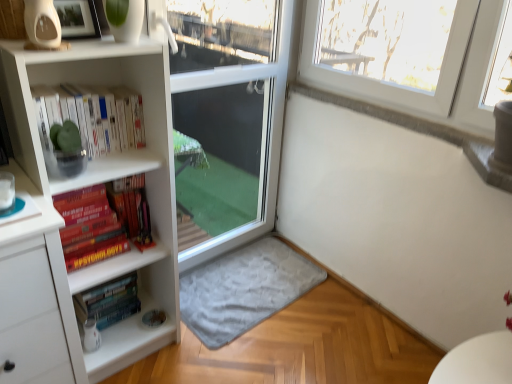
Question: Considering the relative positions of gray soft rug at lower center and white glossy bookshelf at upper left in the image provided, is gray soft rug at lower center to the left of white glossy bookshelf at upper left from the viewer's perspective?

Choices:
 (A) no
 (B) yes

Answer: (A)

Question: Is gray soft rug at lower center positioned in front of white glossy bookshelf at upper left?

Choices:
 (A) yes
 (B) no

Answer: (B)

Question: Considering the relative sizes of gray soft rug at lower center and white glossy bookshelf at upper left in the image provided, is gray soft rug at lower center shorter than white glossy bookshelf at upper left?

Choices:
 (A) no
 (B) yes

Answer: (B)

Question: Can you confirm if gray soft rug at lower center is taller than white glossy bookshelf at upper left?

Choices:
 (A) no
 (B) yes

Answer: (A)

Question: From the image's perspective, does gray soft rug at lower center appear higher than white glossy bookshelf at upper left?

Choices:
 (A) no
 (B) yes

Answer: (A)

Question: Is hardcover psychology book at left, which is the 1th book in top-to-bottom order, wider or thinner than gray soft rug at lower center?

Choices:
 (A) wide
 (B) thin

Answer: (B)

Question: Does point (73, 258) appear closer or farther from the camera than point (187, 296)?

Choices:
 (A) farther
 (B) closer

Answer: (B)

Question: Based on their sizes in the image, would you say hardcover psychology book at left, which is the 1th book in top-to-bottom order, is bigger or smaller than gray soft rug at lower center?

Choices:
 (A) small
 (B) big

Answer: (B)

Question: In the image, is hardcover psychology book at left, which is the 1th book in top-to-bottom order, positioned in front of or behind gray soft rug at lower center?

Choices:
 (A) behind
 (B) front

Answer: (B)

Question: Is point (210, 77) positioned closer to the camera than point (272, 312)?

Choices:
 (A) closer
 (B) farther

Answer: (A)

Question: Is transparent glass screen door at center taller or shorter than gray soft rug at lower center?

Choices:
 (A) tall
 (B) short

Answer: (A)

Question: Is transparent glass screen door at center inside the boundaries of gray soft rug at lower center, or outside?

Choices:
 (A) inside
 (B) outside

Answer: (B)

Question: In terms of size, does transparent glass screen door at center appear bigger or smaller than gray soft rug at lower center?

Choices:
 (A) big
 (B) small

Answer: (A)

Question: Does point (84, 317) appear closer or farther from the camera than point (30, 117)?

Choices:
 (A) farther
 (B) closer

Answer: (A)

Question: From a real-world perspective, is hardcover books at lower left, which appears as the 2th book when viewed from the top, physically located above or below white glossy bookshelf at upper left?

Choices:
 (A) above
 (B) below

Answer: (B)